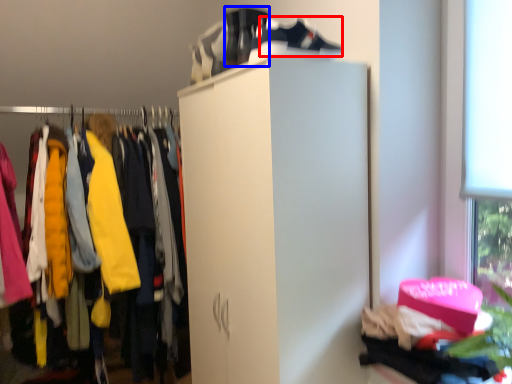
Question: Which object is closer to the camera taking this photo, shoe (highlighted by a red box) or running shoe (highlighted by a blue box)?

Choices:
 (A) shoe
 (B) running shoe

Answer: (A)